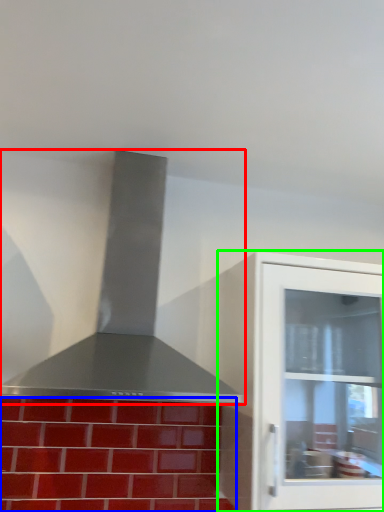
Question: Which is nearer to the vent (highlighted by a red box)? brickwork (highlighted by a blue box) or cabinetry (highlighted by a green box).

Choices:
 (A) brickwork
 (B) cabinetry

Answer: (A)